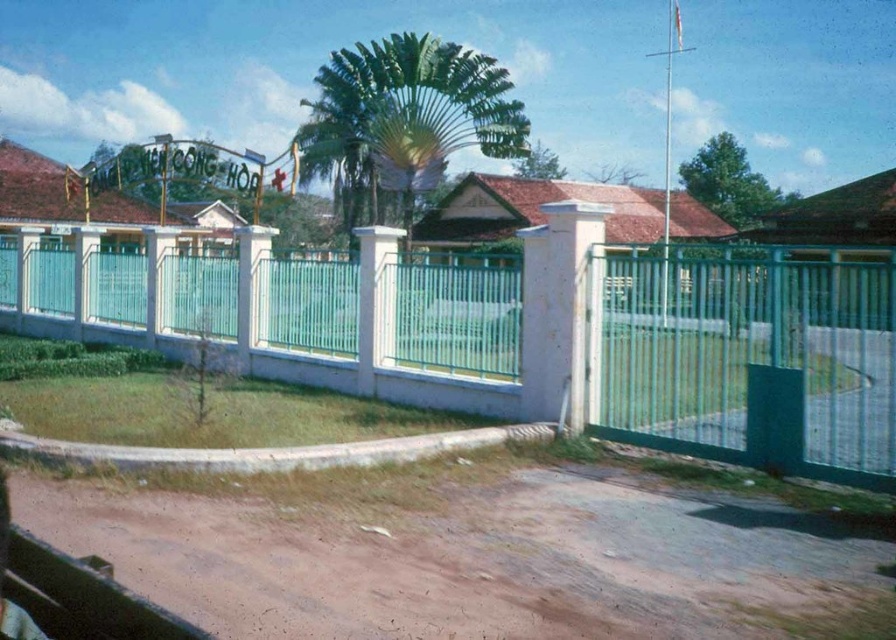
Question: Is brown dirt track at lower center to the right of green leafy palm tree at center from the viewer's perspective?

Choices:
 (A) yes
 (B) no

Answer: (A)

Question: Which object is the farthest from the teal metal fence at center?

Choices:
 (A) green leafy palm tree at center
 (B) brown dirt track at lower center

Answer: (A)

Question: Based on their relative distances, which object is nearer to the green leafy palm tree at center?

Choices:
 (A) brown dirt track at lower center
 (B) teal metal fence at center

Answer: (B)

Question: Considering the real-world distances, which object is farthest from the brown dirt track at lower center?

Choices:
 (A) teal metal fence at center
 (B) green leafy palm tree at center

Answer: (B)

Question: Observing the image, what is the correct spatial positioning of teal metal fence at center in reference to brown dirt track at lower center?

Choices:
 (A) below
 (B) above

Answer: (B)

Question: Is the position of teal metal fence at center more distant than that of brown dirt track at lower center?

Choices:
 (A) no
 (B) yes

Answer: (B)